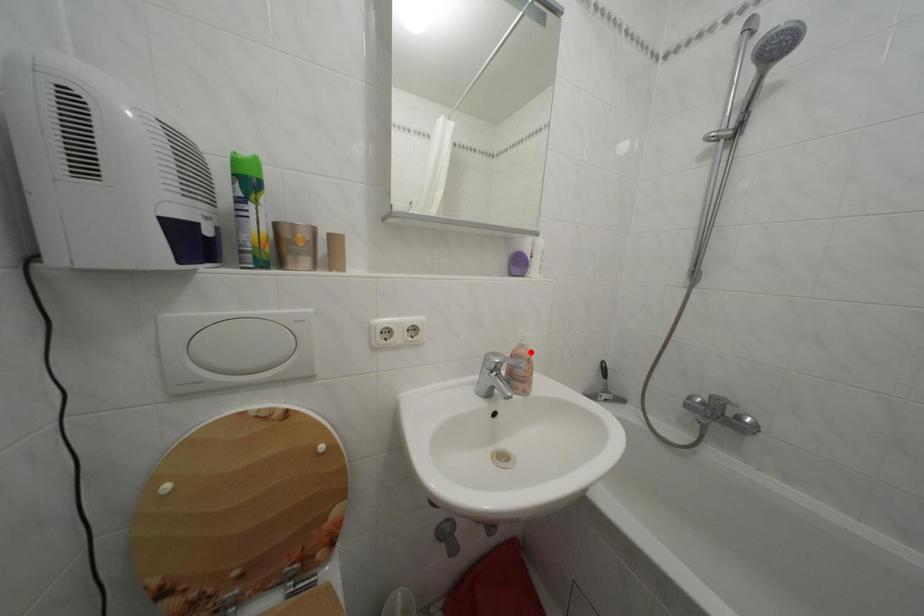
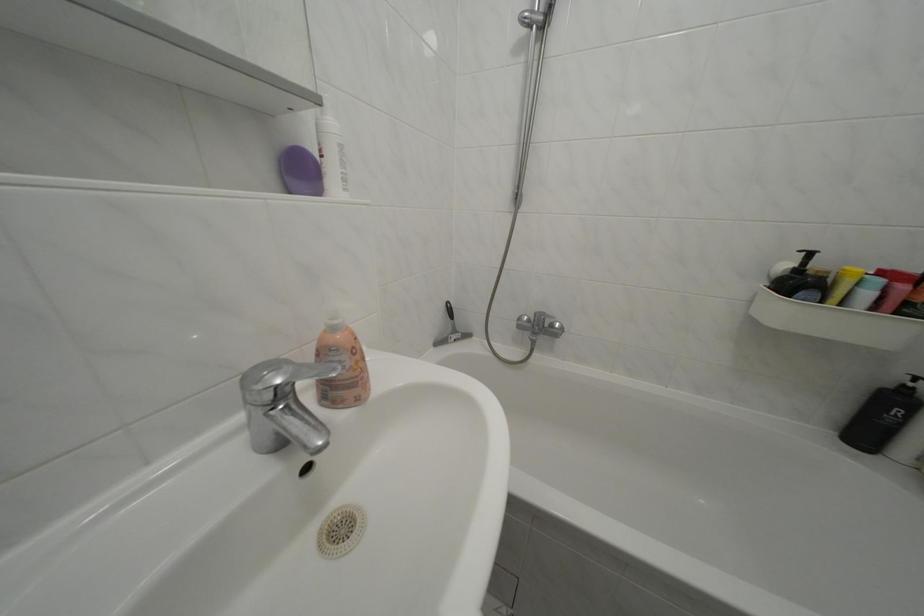
Where in the second image is the point corresponding to the highlighted location from the first image?

(342, 334)